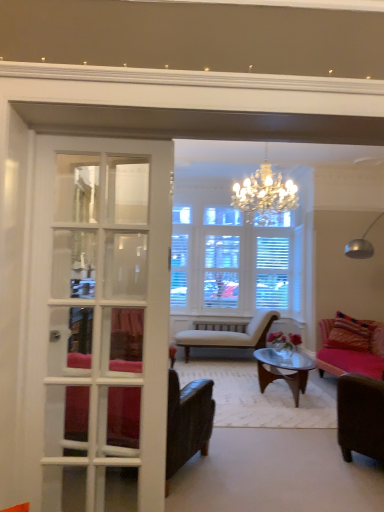
Question: Does beige striped chaise lounge at center, placed as the 3th chair when sorted from front to back, have a lesser width compared to white glass door at left?

Choices:
 (A) yes
 (B) no

Answer: (B)

Question: Considering the relative sizes of beige striped chaise lounge at center, placed as the 3th chair when sorted from front to back, and white glass door at left in the image provided, is beige striped chaise lounge at center, placed as the 3th chair when sorted from front to back, bigger than white glass door at left?

Choices:
 (A) yes
 (B) no

Answer: (A)

Question: Is beige striped chaise lounge at center, which ranks as the first chair in back-to-front order, positioned behind white glass door at left?

Choices:
 (A) no
 (B) yes

Answer: (B)

Question: Is beige striped chaise lounge at center, placed as the 3th chair when sorted from front to back, completely or partially outside of white glass door at left?

Choices:
 (A) yes
 (B) no

Answer: (A)

Question: Could you tell me if beige striped chaise lounge at center, placed as the 3th chair when sorted from front to back, is turned towards white glass door at left?

Choices:
 (A) yes
 (B) no

Answer: (A)

Question: Considering the relative positions of beige striped chaise lounge at center, placed as the 3th chair when sorted from front to back, and white glass door at left in the image provided, is beige striped chaise lounge at center, placed as the 3th chair when sorted from front to back, in front of white glass door at left?

Choices:
 (A) no
 (B) yes

Answer: (A)

Question: Is white glass door at left smaller than brown leather chair at lower right, marked as the second chair in a front-to-back arrangement?

Choices:
 (A) no
 (B) yes

Answer: (B)

Question: Can you confirm if white glass door at left is positioned to the right of brown leather chair at lower right, marked as the second chair in a front-to-back arrangement?

Choices:
 (A) no
 (B) yes

Answer: (A)

Question: Considering the relative sizes of white glass door at left and brown leather chair at lower right, which is counted as the second chair, starting from the back, in the image provided, is white glass door at left taller than brown leather chair at lower right, which is counted as the second chair, starting from the back,?

Choices:
 (A) yes
 (B) no

Answer: (A)

Question: Would you say white glass door at left is outside brown leather chair at lower right, marked as the second chair in a front-to-back arrangement?

Choices:
 (A) no
 (B) yes

Answer: (B)

Question: Does white glass door at left appear on the left side of brown leather chair at lower right, which is counted as the second chair, starting from the back?

Choices:
 (A) no
 (B) yes

Answer: (B)

Question: Does white glass door at left have a lesser width compared to brown leather chair at lower right, which is counted as the second chair, starting from the back?

Choices:
 (A) yes
 (B) no

Answer: (A)

Question: Considering the relative positions of beige striped chaise lounge at center, which ranks as the first chair in back-to-front order, and leather armchair at left, the 3th chair viewed from the back, in the image provided, is beige striped chaise lounge at center, which ranks as the first chair in back-to-front order, to the right of leather armchair at left, the 3th chair viewed from the back, from the viewer's perspective?

Choices:
 (A) no
 (B) yes

Answer: (B)